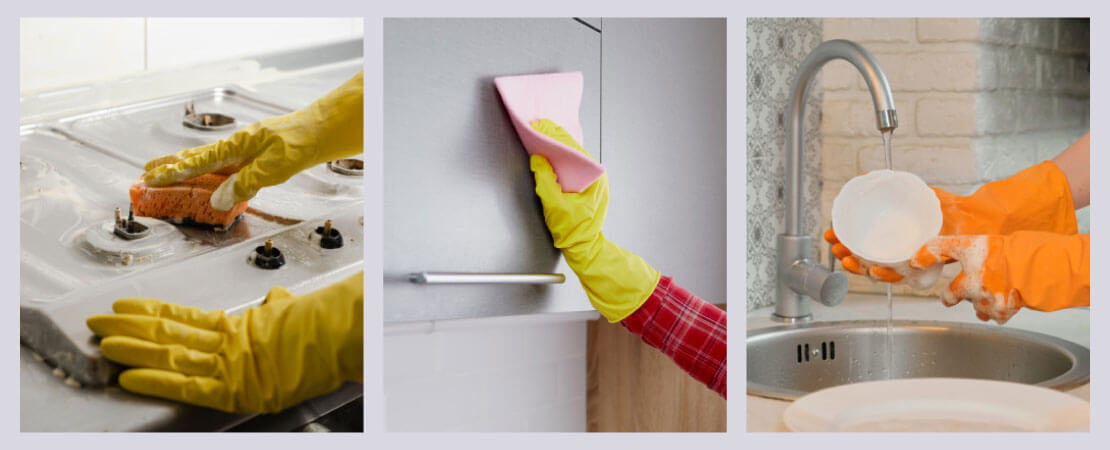
Where is `metal sink basin`? metal sink basin is located at coordinates (938, 356).